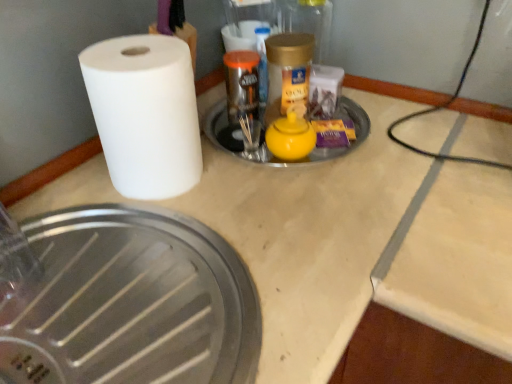
Question: Does yellow matte teapot at center, the first manhole cover from the top, lie behind white matte paper towel at left?

Choices:
 (A) no
 (B) yes

Answer: (B)

Question: Does yellow matte teapot at center, which appears as the 2th manhole cover when ordered from the bottom, have a greater height compared to white matte paper towel at left?

Choices:
 (A) no
 (B) yes

Answer: (A)

Question: Considering the relative positions of yellow matte teapot at center, which appears as the 2th manhole cover when ordered from the bottom, and white matte paper towel at left in the image provided, is yellow matte teapot at center, which appears as the 2th manhole cover when ordered from the bottom, to the left of white matte paper towel at left from the viewer's perspective?

Choices:
 (A) yes
 (B) no

Answer: (B)

Question: From a real-world perspective, is yellow matte teapot at center, the first manhole cover from the top, positioned under white matte paper towel at left based on gravity?

Choices:
 (A) no
 (B) yes

Answer: (B)

Question: From a real-world perspective, does yellow matte teapot at center, the first manhole cover from the top, stand above white matte paper towel at left?

Choices:
 (A) no
 (B) yes

Answer: (A)

Question: Does yellow matte teapot at center, the first manhole cover from the top, touch white matte paper towel at left?

Choices:
 (A) no
 (B) yes

Answer: (A)

Question: Is gold metallic jar at upper center facing away from white matte paper towel at left?

Choices:
 (A) no
 (B) yes

Answer: (A)

Question: Is gold metallic jar at upper center to the right of white matte paper towel at left from the viewer's perspective?

Choices:
 (A) no
 (B) yes

Answer: (B)

Question: From a real-world perspective, is gold metallic jar at upper center beneath white matte paper towel at left?

Choices:
 (A) no
 (B) yes

Answer: (A)

Question: Can you confirm if gold metallic jar at upper center is thinner than white matte paper towel at left?

Choices:
 (A) no
 (B) yes

Answer: (B)

Question: From the image's perspective, is gold metallic jar at upper center on white matte paper towel at left?

Choices:
 (A) yes
 (B) no

Answer: (A)

Question: From a real-world perspective, is gold metallic jar at upper center over white matte paper towel at left?

Choices:
 (A) no
 (B) yes

Answer: (B)

Question: Is yellow matte teapot at center, which appears as the 2th manhole cover when ordered from the bottom, shorter than brushed metal manhole cover at lower left, which is counted as the 1th manhole cover, starting from the bottom?

Choices:
 (A) yes
 (B) no

Answer: (A)